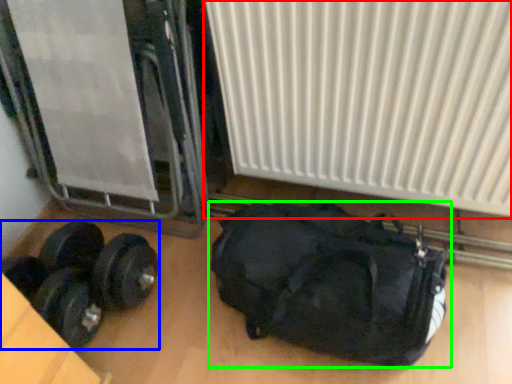
Question: Estimate the real-world distances between objects in this image. Which object is farther from radiator (highlighted by a red box), dumbbell (highlighted by a blue box) or luggage and bags (highlighted by a green box)?

Choices:
 (A) dumbbell
 (B) luggage and bags

Answer: (A)